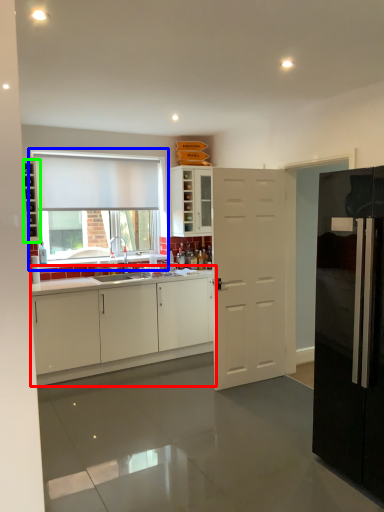
Question: Which object is positioned farthest from cabinetry (highlighted by a red box)? Select from window (highlighted by a blue box) and shelf (highlighted by a green box).

Choices:
 (A) window
 (B) shelf

Answer: (B)